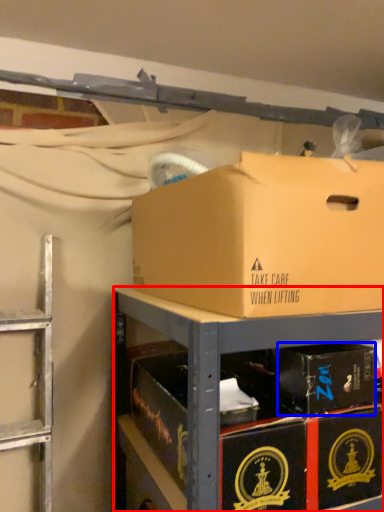
Question: Which of the following is the closest to the observer, shelf (highlighted by a red box) or box (highlighted by a blue box)?

Choices:
 (A) shelf
 (B) box

Answer: (A)